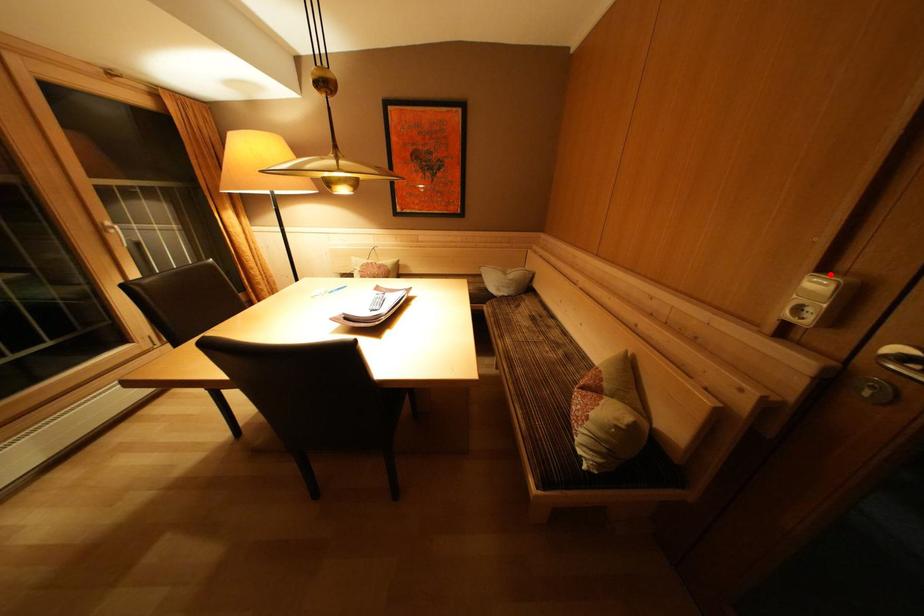
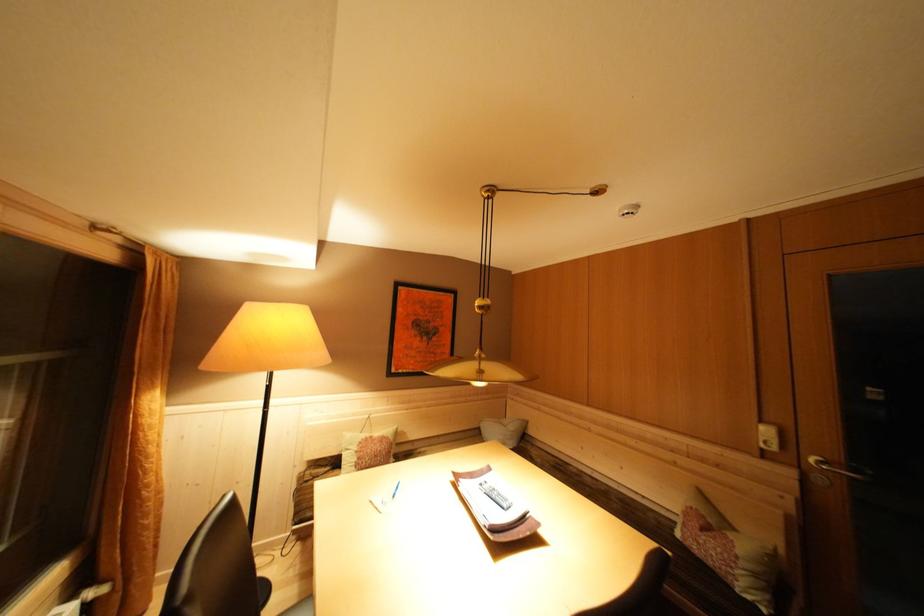
Locate, in the second image, the point that corresponds to the highlighted location in the first image.

(768, 427)